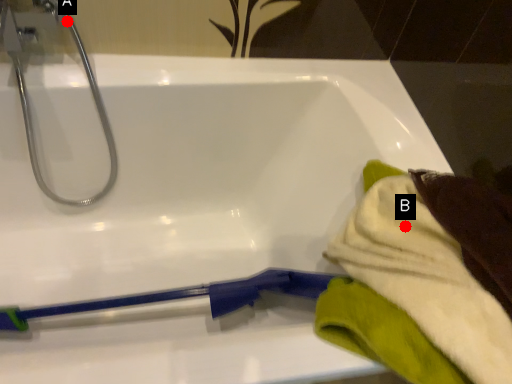
Question: Two points are circled on the image, labeled by A and B beside each circle. Which of the following is the farthest from the observer?

Choices:
 (A) A is further
 (B) B is further

Answer: (A)